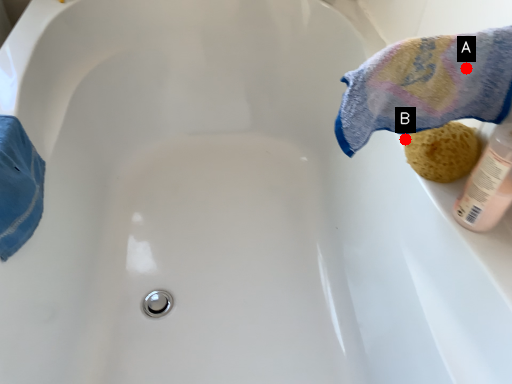
Question: Two points are circled on the image, labeled by A and B beside each circle. Among these points, which one is nearest to the camera?

Choices:
 (A) A is closer
 (B) B is closer

Answer: (A)